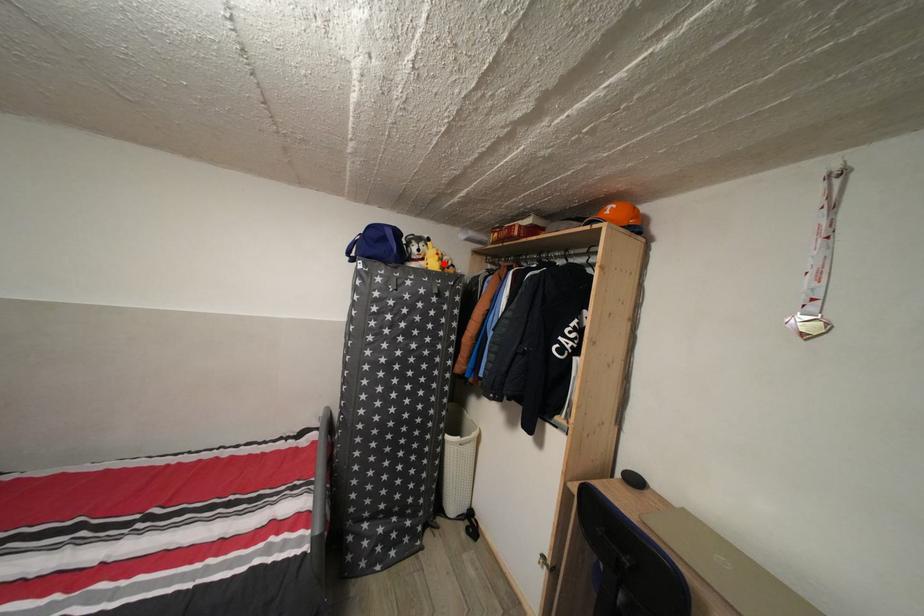
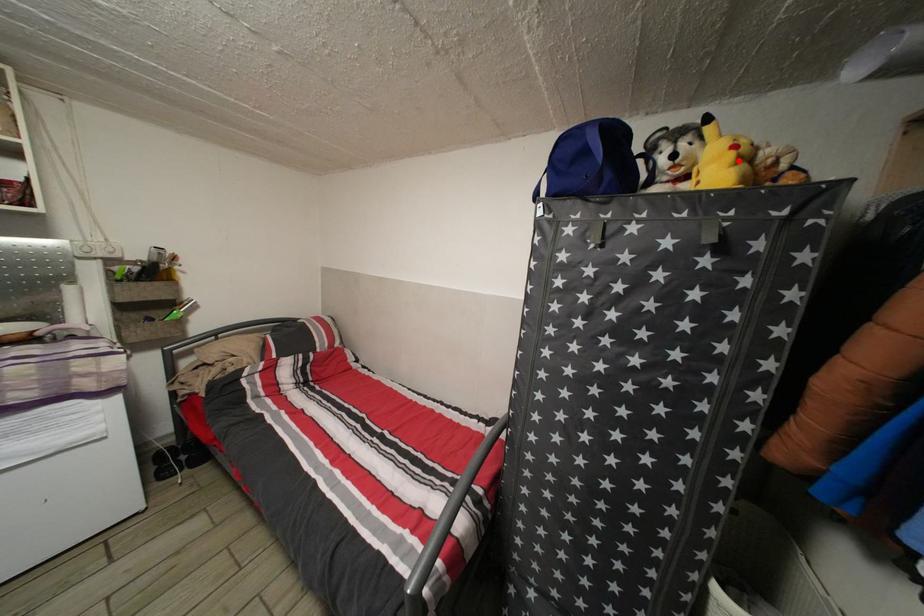
I am providing you with two images of the same scene from different viewpoints. A red point is marked on the first image and another point is marked on the second image. Do the highlighted points in image1 and image2 indicate the same real-world spot?

Yes